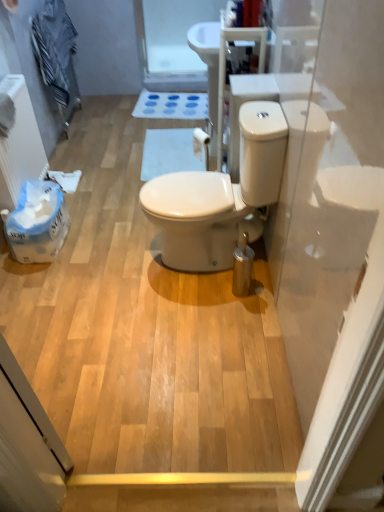
What is the approximate width of white plastic radiator at left?

The width of white plastic radiator at left is 5.84 inches.

Describe the element at coordinates (20, 144) in the screenshot. I see `white plastic radiator at left` at that location.

Measure the distance between white matte toilet paper at center and camera.

They are 7.61 feet apart.

What is the approximate width of white glossy toilet at center?

white glossy toilet at center is 26.15 inches in width.

Where is `white glossy toilet at center`? This screenshot has height=512, width=384. white glossy toilet at center is located at coordinates (220, 196).

Describe the element at coordinates (171, 42) in the screenshot. I see `transparent plastic screen door at upper center` at that location.

Locate an element on the screen. This screenshot has height=512, width=384. striped cotton towel at upper left is located at coordinates (54, 47).

Is transparent plastic screen door at upper center closer to the viewer compared to white plastic radiator at left?

No.

Is transparent plastic screen door at upper center turned away from white plastic radiator at left?

No, transparent plastic screen door at upper center is not facing away from white plastic radiator at left.

In the scene shown: Is transparent plastic screen door at upper center next to white plastic radiator at left and touching it?

transparent plastic screen door at upper center and white plastic radiator at left are clearly separated.

In terms of height, does transparent plastic screen door at upper center look taller or shorter compared to white plastic radiator at left?

Clearly, transparent plastic screen door at upper center is taller compared to white plastic radiator at left.

From the picture: From a real-world perspective, is white matte bath mat at center on top of striped cotton towel at upper left?

Actually, white matte bath mat at center is physically below striped cotton towel at upper left in the real world.

Does white matte bath mat at center have a smaller size compared to striped cotton towel at upper left?

Indeed, white matte bath mat at center has a smaller size compared to striped cotton towel at upper left.

Which of these two, white matte bath mat at center or striped cotton towel at upper left, is wider?

Wider between the two is white matte bath mat at center.

Which is more distant, (204, 134) or (53, 39)?

The point (53, 39) is more distant.

Can you confirm if white matte toilet paper at center is positioned to the left of striped cotton towel at upper left?

No.

Can you tell me how much white matte toilet paper at center and striped cotton towel at upper left differ in facing direction?

The angular difference between white matte toilet paper at center and striped cotton towel at upper left is 158 degrees.

Does white matte bath mat at center have a smaller size compared to white plastic radiator at left?

Yes.

Which is further, (143, 170) or (18, 191)?

The point (143, 170) is farther from the camera.

Looking at this image, is white matte bath mat at center looking in the opposite direction of white plastic radiator at left?

No.

From a real-world perspective, is white matte bath mat at center under white plastic radiator at left?

Correct, in the physical world, white matte bath mat at center is lower than white plastic radiator at left.

Can you tell me how much striped cotton towel at upper left and transparent plastic screen door at upper center differ in facing direction?

93.3 degrees.

Is striped cotton towel at upper left oriented towards transparent plastic screen door at upper center?

Yes, striped cotton towel at upper left is aimed at transparent plastic screen door at upper center.

Is there a large distance between striped cotton towel at upper left and transparent plastic screen door at upper center?

Actually, striped cotton towel at upper left and transparent plastic screen door at upper center are a little close together.

Is point (44, 75) more distant than point (193, 67)?

No.

Does white plastic radiator at left turn towards white matte toilet paper at center?

Yes, white plastic radiator at left is aimed at white matte toilet paper at center.

Would you say white plastic radiator at left is outside white matte toilet paper at center?

Yes.

Can you confirm if white plastic radiator at left is thinner than white matte toilet paper at center?

Incorrect, the width of white plastic radiator at left is not less than that of white matte toilet paper at center.

How many degrees apart are the facing directions of white plastic radiator at left and white matte toilet paper at center?

white plastic radiator at left and white matte toilet paper at center are facing 154 degrees away from each other.

Based on the photo, which object is thinner, transparent plastic screen door at upper center or white glossy toilet at center?

Thinner between the two is transparent plastic screen door at upper center.

Is transparent plastic screen door at upper center situated inside white glossy toilet at center or outside?

transparent plastic screen door at upper center is outside white glossy toilet at center.

Based on their positions, is transparent plastic screen door at upper center located to the left or right of white glossy toilet at center?

From the image, it's evident that transparent plastic screen door at upper center is to the left of white glossy toilet at center.

In the scene shown: Looking at the image, does transparent plastic screen door at upper center seem bigger or smaller compared to white glossy toilet at center?

In the image, transparent plastic screen door at upper center appears to be smaller than white glossy toilet at center.

Identify the location of radiator that appears below the transparent plastic screen door at upper center (from the image's perspective). (20, 144).

Identify the location of bath mat below the striped cotton towel at upper left (from a real-world perspective). (170, 153).

From the image, which object appears to be nearer to white matte toilet paper at center, white matte bath mat at center or white glossy toilet at center?

Among the two, white glossy toilet at center is located nearer to white matte toilet paper at center.

When comparing their distances from white plastic radiator at left, does white matte toilet paper at center or transparent plastic screen door at upper center seem further?

The object further to white plastic radiator at left is transparent plastic screen door at upper center.

From the image, which object appears to be farther from white matte bath mat at center, white glossy toilet at center or striped cotton towel at upper left?

Among the two, white glossy toilet at center is located further to white matte bath mat at center.

Estimate the real-world distances between objects in this image. Which object is closer to white matte toilet paper at center, striped cotton towel at upper left or white matte bath mat at center?

Among the two, white matte bath mat at center is located nearer to white matte toilet paper at center.

Based on their spatial positions, is transparent plastic screen door at upper center or striped cotton towel at upper left closer to white matte bath mat at center?

striped cotton towel at upper left.

In the scene shown: Which object lies nearer to the anchor point white plastic radiator at left, transparent plastic screen door at upper center or white matte toilet paper at center?

white matte toilet paper at center lies closer to white plastic radiator at left than the other object.

Looking at the image, which one is located further to white plastic radiator at left, striped cotton towel at upper left or white glossy toilet at center?

Among the two, white glossy toilet at center is located further to white plastic radiator at left.

Based on the photo, looking at the image, which one is located further to white glossy toilet at center, transparent plastic screen door at upper center or white plastic radiator at left?

The object further to white glossy toilet at center is transparent plastic screen door at upper center.

The image size is (384, 512). Find the location of `laundry between white glossy toilet at center and transparent plastic screen door at upper center in the front-back direction`. laundry between white glossy toilet at center and transparent plastic screen door at upper center in the front-back direction is located at coordinates (54, 47).

Locate an element on the screen. This screenshot has width=384, height=512. bath mat situated between striped cotton towel at upper left and white matte toilet paper at center from left to right is located at coordinates (170, 153).

I want to click on laundry between transparent plastic screen door at upper center and white matte toilet paper at center in the vertical direction, so click(x=54, y=47).

Where is `toilet paper located between white plastic radiator at left and white glossy toilet at center in the left-right direction`? The image size is (384, 512). toilet paper located between white plastic radiator at left and white glossy toilet at center in the left-right direction is located at coordinates (201, 145).